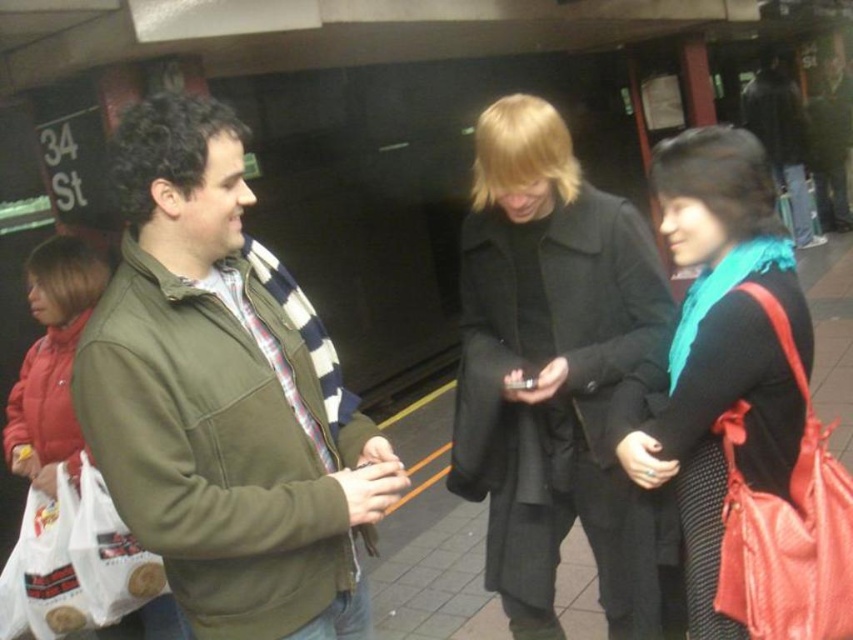
In the scene shown: You are standing at the subway station platform at 34 St. You see two points marked on the platform floor. The first point is at coordinates point (184, 164) and the second point is at point (706, 301). If you are facing the direction of the train tracks, which point is closer to the train entrance?

Point (184, 164) is in front of point (706, 301), so when facing the train tracks, point (184, 164) is closer to the train entrance.

You are a tailor who needs to determine which item requires more fabric for alterations between the matte green jacket at left and the teal fabric scarf at center. Based on the scene, which item would need more fabric?

The matte green jacket at left is bigger than the teal fabric scarf at center, so it would require more fabric for alterations.

You are standing on the subway platform and notice two items at the center of the scene. The items are the black wool coat at center and the teal fabric scarf at center. Which item is positioned lower in the image?

The black wool coat at center is located below the teal fabric scarf at center, so the black wool coat at center is positioned lower in the image.